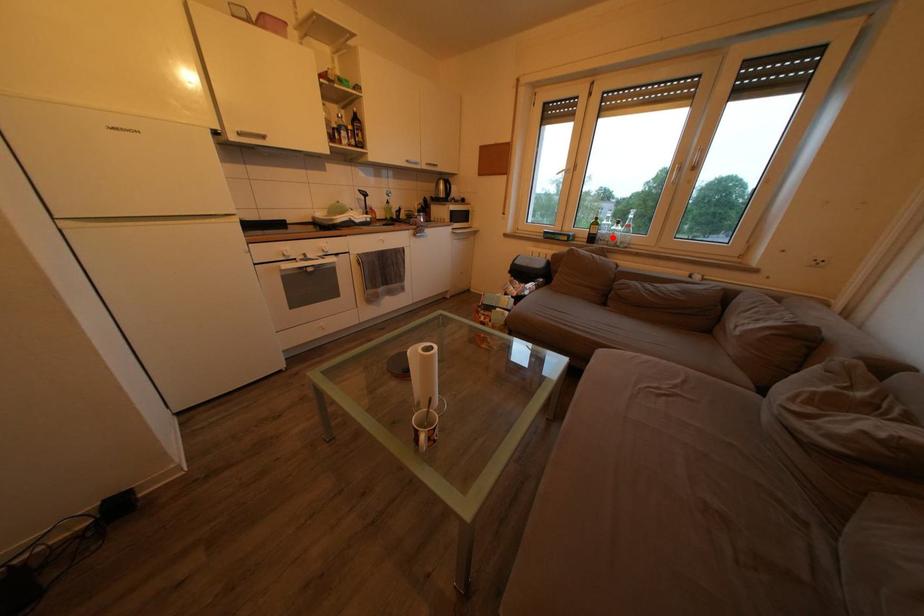
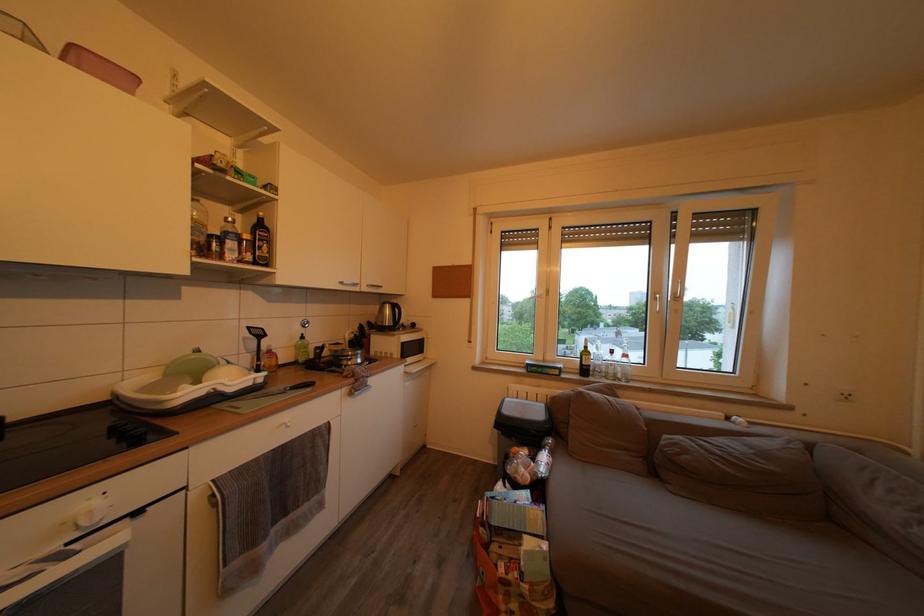
The point at the highlighted location is marked in the first image. Where is the corresponding point in the second image?

(608, 369)